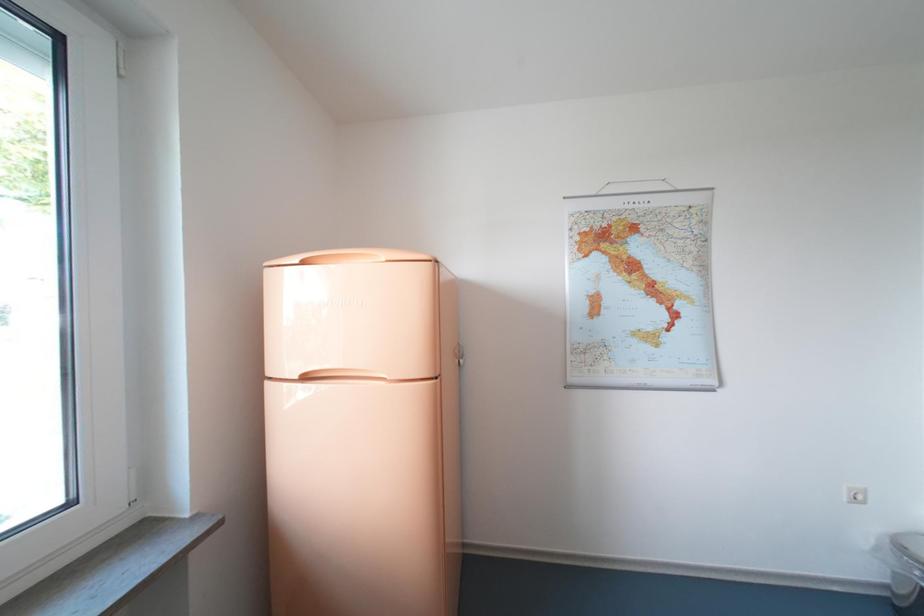
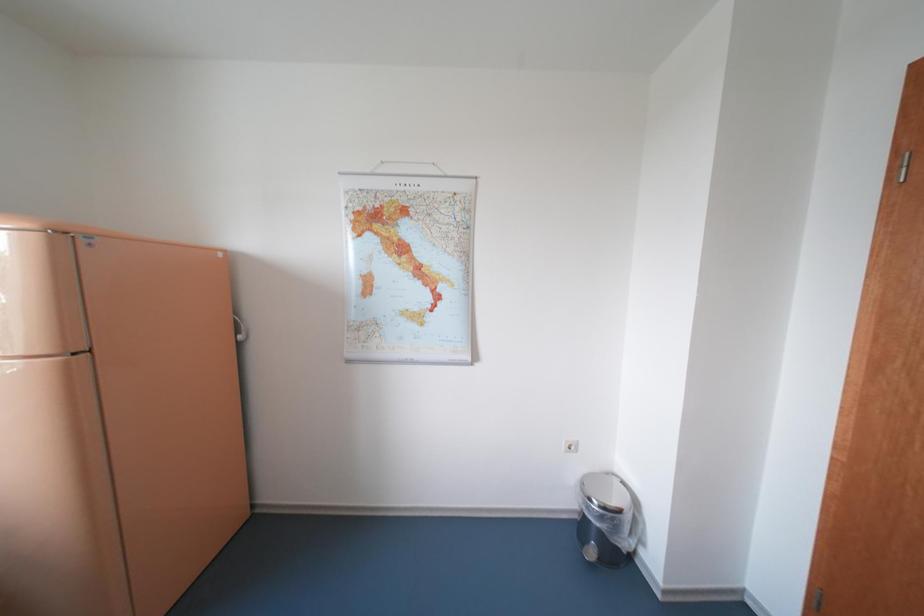
Question: The images are taken continuously from a first-person perspective. In which direction are you moving?

Choices:
 (A) Left
 (B) Right
 (C) Forward
 (D) Backward

Answer: (B)